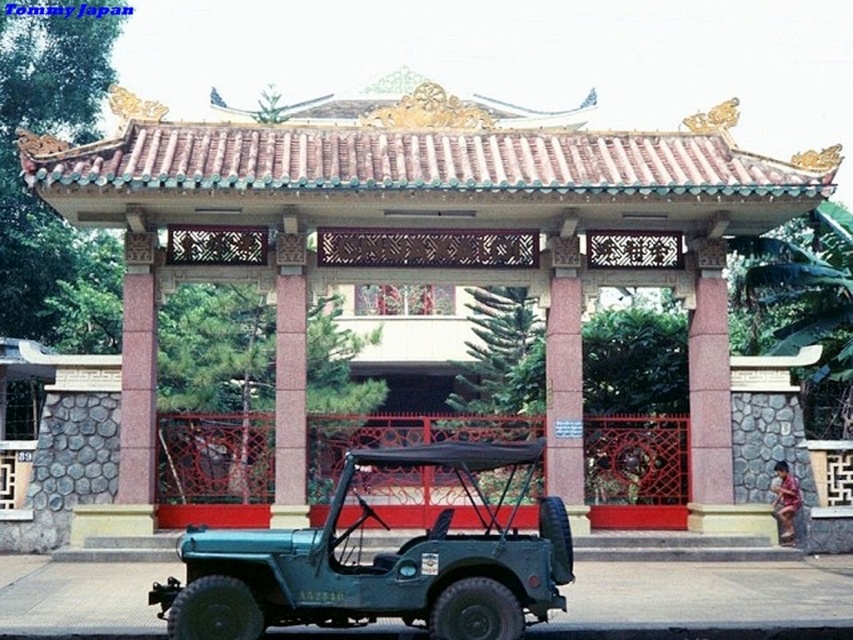
Question: Does matte pink gazebo at center appear under teal matte jeep at center?

Choices:
 (A) yes
 (B) no

Answer: (B)

Question: Which point is farther to the camera?

Choices:
 (A) matte pink gazebo at center
 (B) teal matte jeep at center

Answer: (A)

Question: Which point is closer to the camera?

Choices:
 (A) matte pink gazebo at center
 (B) teal matte jeep at center

Answer: (B)

Question: Does matte pink gazebo at center have a larger size compared to teal matte jeep at center?

Choices:
 (A) no
 (B) yes

Answer: (B)

Question: Is matte pink gazebo at center closer to camera compared to teal matte jeep at center?

Choices:
 (A) yes
 (B) no

Answer: (B)